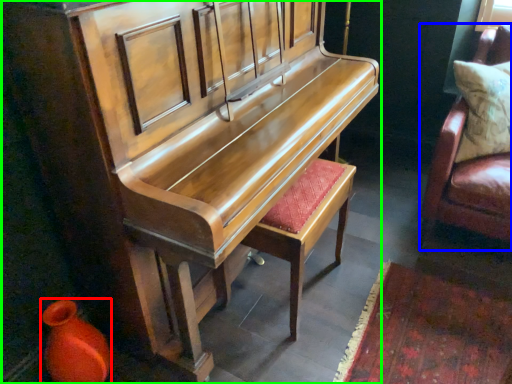
Question: Estimate the real-world distances between objects in this image. Which object is closer to vase (highlighted by a red box), furniture (highlighted by a blue box) or furniture (highlighted by a green box)?

Choices:
 (A) furniture
 (B) furniture

Answer: (B)